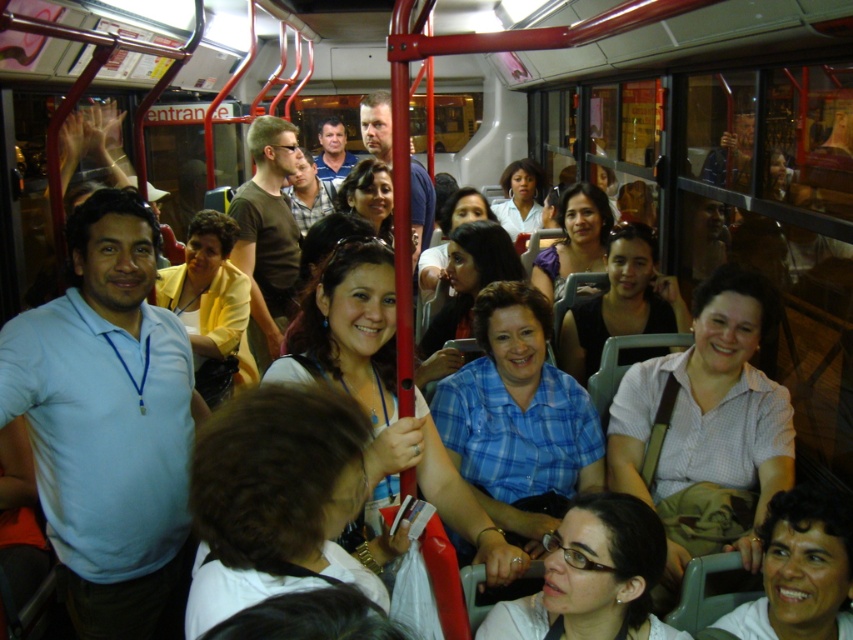
Can you confirm if dark brown hair at center is positioned below blue plaid shirt at center?

Correct, dark brown hair at center is located below blue plaid shirt at center.

Is point (215, 580) positioned before point (456, 433)?

Yes, point (215, 580) is closer to viewer.

This screenshot has width=853, height=640. What do you see at coordinates (276, 499) in the screenshot? I see `dark brown hair at center` at bounding box center [276, 499].

Locate an element on the screen. dark brown hair at center is located at coordinates (276, 499).

Can you confirm if blue plaid shirt at center is thinner than smooth skin face at lower right?

Incorrect, blue plaid shirt at center's width is not less than smooth skin face at lower right's.

Which is more to the left, blue plaid shirt at center or smooth skin face at lower right?

blue plaid shirt at center is more to the left.

Who is more distant from viewer, (x=514, y=328) or (x=813, y=499)?

The point (x=514, y=328) is more distant.

At what (x,y) coordinates should I click in order to perform the action: click on blue plaid shirt at center. Please return your answer as a coordinate pair (x, y). The width and height of the screenshot is (853, 640). Looking at the image, I should click on (518, 417).

Is light blue cotton shirt at center to the left of smooth skin face at lower right from the viewer's perspective?

Indeed, light blue cotton shirt at center is positioned on the left side of smooth skin face at lower right.

Who is taller, light blue cotton shirt at center or smooth skin face at lower right?

Standing taller between the two is light blue cotton shirt at center.

Is point (56, 365) more distant than point (770, 593)?

That is True.

In order to click on light blue cotton shirt at center in this screenshot , I will do `click(109, 424)`.